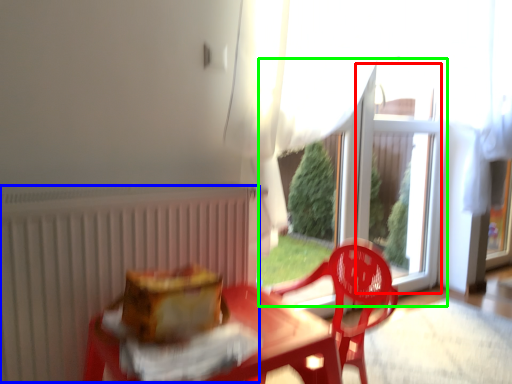
Question: Estimate the real-world distances between objects in this image. Which object is closer to window screen (highlighted by a red box), radiator (highlighted by a blue box) or glass door (highlighted by a green box)?

Choices:
 (A) radiator
 (B) glass door

Answer: (B)